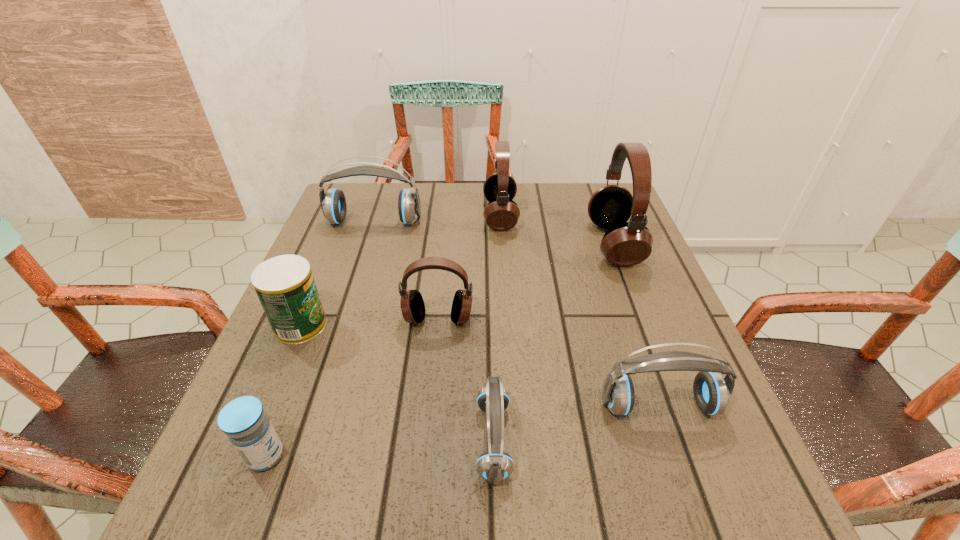
Find the location of a particular element. vacant point located on the ear cups of the rightmost blue headset is located at coordinates (697, 515).

You are a GUI agent. You are given a task and a screenshot of the screen. Output one action in this format:
    pyautogui.click(x=<x>, y=<y>)
    Task: Click on the vacant space positioned 0.340m on the right of the can
    
    Given the screenshot: What is the action you would take?
    pyautogui.click(x=493, y=325)

You are a GUI agent. You are given a task and a screenshot of the screen. Output one action in this format:
    pyautogui.click(x=<x>, y=<y>)
    Task: Click on the blank space located 0.360m on the right of the medicine
    This screenshot has height=540, width=960.
    Given the screenshot: What is the action you would take?
    pyautogui.click(x=516, y=456)

The image size is (960, 540). Find the location of `vacant region located on the ear cups of the shortest headset`. vacant region located on the ear cups of the shortest headset is located at coordinates (283, 440).

The image size is (960, 540). I want to click on free space located on the ear cups of the shortest headset, so click(358, 440).

At what (x,y) coordinates should I click in order to perform the action: click on blank space located on the ear cups of the shortest headset. Please return your answer as a coordinate pair (x, y). The height and width of the screenshot is (540, 960). Looking at the image, I should click on (433, 440).

The height and width of the screenshot is (540, 960). Find the location of `medicine positioned at the near edge`. medicine positioned at the near edge is located at coordinates (243, 420).

Locate an element on the screen. This screenshot has width=960, height=540. headset present at the near edge is located at coordinates (494, 466).

Find the location of a particular element. Image resolution: width=960 pixels, height=540 pixels. headset that is at the left edge is located at coordinates (333, 203).

Identify the location of can that is at the left edge. Image resolution: width=960 pixels, height=540 pixels. (285, 286).